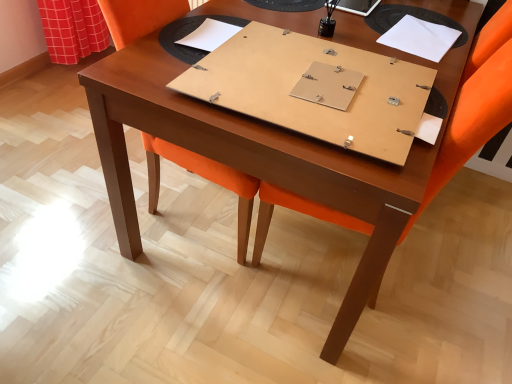
The width and height of the screenshot is (512, 384). Identify the location of free spot in front of white paper at upper right, acting as the 3th notebook starting from the left. (397, 70).